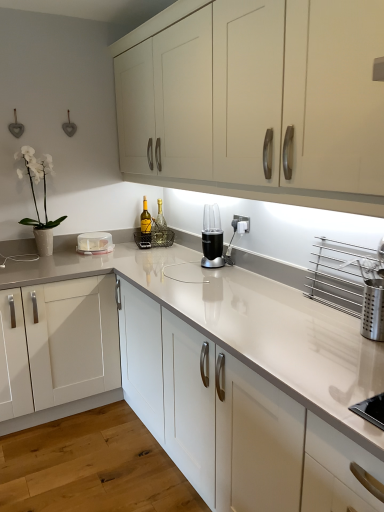
Image resolution: width=384 pixels, height=512 pixels. Find the location of `matte white cabinets at upper center`. matte white cabinets at upper center is located at coordinates (257, 99).

Measure the distance between yellow glass bottle at center, the second bottle viewed from the right, and camera.

yellow glass bottle at center, the second bottle viewed from the right, and camera are 2.84 meters apart from each other.

Locate an element on the screen. clear plastic container at left is located at coordinates (94, 243).

What do you see at coordinates (94, 243) in the screenshot? I see `clear plastic container at left` at bounding box center [94, 243].

This screenshot has width=384, height=512. What are the coordinates of `matte white cabinets at upper center` in the screenshot? It's located at (257, 99).

Is white glossy countertop at center taller or shorter than yellow glass bottle at center, the second bottle viewed from the right?

Considering their sizes, white glossy countertop at center has more height than yellow glass bottle at center, the second bottle viewed from the right.

What's the angular difference between white glossy countertop at center and yellow glass bottle at center, the 1th bottle in the left-to-right sequence,'s facing directions?

The facing directions of white glossy countertop at center and yellow glass bottle at center, the 1th bottle in the left-to-right sequence, are 25.4 degrees apart.

Can you confirm if white glossy countertop at center is positioned to the right of yellow glass bottle at center, the 1th bottle in the left-to-right sequence?

In fact, white glossy countertop at center is to the left of yellow glass bottle at center, the 1th bottle in the left-to-right sequence.

From a real-world perspective, which is physically above, white glossy countertop at center or yellow glass bottle at center, the second bottle viewed from the right?

yellow glass bottle at center, the second bottle viewed from the right, is physically above.

How many degrees apart are the facing directions of yellow glass bottle at center, the second bottle viewed from the right, and white glossy countertop at center?

25.4 degrees separate the facing orientations of yellow glass bottle at center, the second bottle viewed from the right, and white glossy countertop at center.

Which is more to the right, yellow glass bottle at center, the second bottle viewed from the right, or white glossy countertop at center?

yellow glass bottle at center, the second bottle viewed from the right.

Is yellow glass bottle at center, the 1th bottle in the left-to-right sequence, in contact with white glossy countertop at center?

They are not placed beside each other.

I want to click on counter top that appears below the yellow glass bottle at center, the 1th bottle in the left-to-right sequence (from the image's perspective), so click(x=246, y=322).

Can you confirm if black plastic blender at center is shorter than white glossy countertop at center?

Yes, black plastic blender at center is shorter than white glossy countertop at center.

Considering the positions of point (216, 213) and point (248, 322), is point (216, 213) closer or farther from the camera than point (248, 322)?

Point (216, 213) appears to be farther away from the viewer than point (248, 322).

From the image's perspective, which object appears higher, black plastic blender at center or white glossy countertop at center?

black plastic blender at center appears higher in the image.

Considering the positions of objects black plastic blender at center and white glossy countertop at center in the image provided, who is in front, black plastic blender at center or white glossy countertop at center?

white glossy countertop at center is more forward.

This screenshot has height=512, width=384. Find the location of `cabinetry in front of the yellow glass bottle at center, the second bottle viewed from the right`. cabinetry in front of the yellow glass bottle at center, the second bottle viewed from the right is located at coordinates (257, 99).

Which is in front, matte white cabinets at upper center or yellow glass bottle at center, the second bottle viewed from the right?

Positioned in front is matte white cabinets at upper center.

In the scene shown: From a real-world perspective, is matte white cabinets at upper center physically above yellow glass bottle at center, the 1th bottle in the left-to-right sequence?

Indeed, from a real-world perspective, matte white cabinets at upper center stands above yellow glass bottle at center, the 1th bottle in the left-to-right sequence.

What's the angular difference between matte white cabinets at upper center and yellow glass bottle at center, the 1th bottle in the left-to-right sequence,'s facing directions?

They differ by 65.1 degrees in their facing directions.

Considering the sizes of objects white glossy countertop at center and clear glass bottle at center, which appears as the 2th bottle when viewed from the left, in the image provided, who is bigger, white glossy countertop at center or clear glass bottle at center, which appears as the 2th bottle when viewed from the left,?

white glossy countertop at center is bigger.

Which of these two, white glossy countertop at center or clear glass bottle at center, arranged as the first bottle when viewed from the right, stands shorter?

Standing shorter between the two is clear glass bottle at center, arranged as the first bottle when viewed from the right.

Between white glossy countertop at center and clear glass bottle at center, which appears as the 2th bottle when viewed from the left, which one is positioned in front?

Positioned in front is white glossy countertop at center.

Which is closer, [166,271] or [160,236]?

→ Clearly, point [166,271] is closer to the camera than point [160,236].

Would you say matte white cabinets at upper center is part of clear glass bottle at center, which appears as the 2th bottle when viewed from the left,'s contents?

No, matte white cabinets at upper center is not a part of clear glass bottle at center, which appears as the 2th bottle when viewed from the left.

Is clear glass bottle at center, which appears as the 2th bottle when viewed from the left, oriented away from matte white cabinets at upper center?

No, clear glass bottle at center, which appears as the 2th bottle when viewed from the left,'s orientation is not away from matte white cabinets at upper center.

Does clear glass bottle at center, arranged as the first bottle when viewed from the right, have a larger size compared to matte white cabinets at upper center?

No.

Considering the positions of objects clear glass bottle at center, which appears as the 2th bottle when viewed from the left, and matte white cabinets at upper center in the image provided, who is in front, clear glass bottle at center, which appears as the 2th bottle when viewed from the left, or matte white cabinets at upper center?

Positioned in front is matte white cabinets at upper center.

From the image's perspective, is black plastic blender at center positioned above or below clear glass bottle at center, which appears as the 2th bottle when viewed from the left?

Based on their image positions, black plastic blender at center is located beneath clear glass bottle at center, which appears as the 2th bottle when viewed from the left.

How many degrees apart are the facing directions of black plastic blender at center and clear glass bottle at center, which appears as the 2th bottle when viewed from the left?

46.8 degrees.

Is black plastic blender at center touching clear glass bottle at center, which appears as the 2th bottle when viewed from the left?

No, black plastic blender at center is not in contact with clear glass bottle at center, which appears as the 2th bottle when viewed from the left.

From the white glossy countertop at center, count 1st bottle to the right and point to it. Please provide its 2D coordinates.

[(145, 219)]

Where is `the 1st bottle located above the white glossy countertop at center (from a real-world perspective)`? This screenshot has width=384, height=512. the 1st bottle located above the white glossy countertop at center (from a real-world perspective) is located at coordinates (145, 219).

Considering their positions, is yellow glass bottle at center, the 1th bottle in the left-to-right sequence, positioned further to clear plastic container at left than white glossy vase at upper left?

white glossy vase at upper left.

Which object lies nearer to the anchor point white glossy countertop at center, white glossy vase at upper left or yellow glass bottle at center, the second bottle viewed from the right?

white glossy vase at upper left lies closer to white glossy countertop at center than the other object.

Looking at the image, which one is located closer to black plastic blender at center, clear plastic container at left or yellow glass bottle at center, the 1th bottle in the left-to-right sequence?

yellow glass bottle at center, the 1th bottle in the left-to-right sequence, lies closer to black plastic blender at center than the other object.

Which object lies nearer to the anchor point white glossy vase at upper left, yellow glass bottle at center, the 1th bottle in the left-to-right sequence, or white glossy countertop at center?

yellow glass bottle at center, the 1th bottle in the left-to-right sequence, is positioned closer to the anchor white glossy vase at upper left.

Looking at this image, estimate the real-world distances between objects in this image. Which object is closer to yellow glass bottle at center, the second bottle viewed from the right, clear glass bottle at center, which appears as the 2th bottle when viewed from the left, or clear plastic container at left?

clear glass bottle at center, which appears as the 2th bottle when viewed from the left.

Estimate the real-world distances between objects in this image. Which object is further from white glossy countertop at center, clear glass bottle at center, arranged as the first bottle when viewed from the right, or clear plastic container at left?

clear glass bottle at center, arranged as the first bottle when viewed from the right, lies further to white glossy countertop at center than the other object.

From the picture: Looking at the image, which one is located closer to white glossy countertop at center, white glossy vase at upper left or matte white cabinets at upper center?

matte white cabinets at upper center lies closer to white glossy countertop at center than the other object.

When comparing their distances from white glossy countertop at center, does clear plastic container at left or matte white cabinets at upper center seem further?

clear plastic container at left is positioned further to the anchor white glossy countertop at center.

Locate an element on the screen. The image size is (384, 512). counter top situated between white glossy vase at upper left and black plastic blender at center from left to right is located at coordinates (246, 322).

At what (x,y) coordinates should I click in order to perform the action: click on home appliance between matte white cabinets at upper center and yellow glass bottle at center, the 1th bottle in the left-to-right sequence, from front to back. Please return your answer as a coordinate pair (x, y). Looking at the image, I should click on (212, 238).

Locate an element on the screen. counter top positioned between matte white cabinets at upper center and clear plastic container at left from near to far is located at coordinates (246, 322).

Identify the location of counter top between clear plastic container at left and black plastic blender at center in the horizontal direction. This screenshot has height=512, width=384. (246, 322).